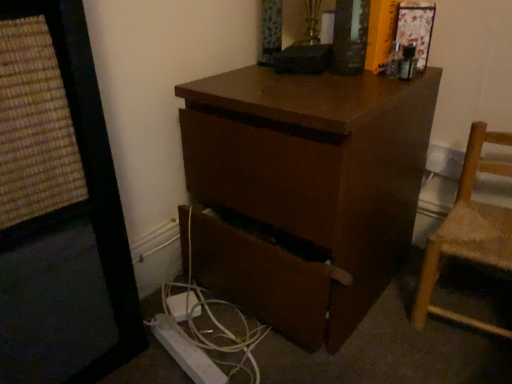
In order to face brown matte desk at center, should I rotate leftwards or rightwards?

Turn right by 6.671 degrees to look at brown matte desk at center.

Where is `brown matte desk at center`? brown matte desk at center is located at coordinates (305, 189).

Image resolution: width=512 pixels, height=384 pixels. I want to click on light brown woven wood chair at right, so click(469, 231).

Locate an element on the screen. This screenshot has width=512, height=384. white plastic cable at lower center is located at coordinates (210, 319).

Are brown matte desk at center and light brown woven wood chair at right far apart?

No, brown matte desk at center is not far away from light brown woven wood chair at right.

Which object is thinner, brown matte desk at center or light brown woven wood chair at right?

Thinner between the two is light brown woven wood chair at right.

From a real-world perspective, is brown matte desk at center above or below light brown woven wood chair at right?

Clearly, from a real-world perspective, brown matte desk at center is above light brown woven wood chair at right.

Is brown matte desk at center taller than light brown woven wood chair at right?

Indeed, brown matte desk at center has a greater height compared to light brown woven wood chair at right.

Locate an element on the screen. Image resolution: width=512 pixels, height=384 pixels. chair that is in front of the white plastic cable at lower center is located at coordinates (469, 231).

Is light brown woven wood chair at right not near white plastic cable at lower center?

No, light brown woven wood chair at right is not far away from white plastic cable at lower center.

Does light brown woven wood chair at right have a larger size compared to white plastic cable at lower center?

Yes, light brown woven wood chair at right is bigger than white plastic cable at lower center.

From the image's perspective, which one is positioned lower, white plastic cable at lower center or light brown woven wood chair at right?

white plastic cable at lower center appears lower in the image.

Does white plastic cable at lower center contain light brown woven wood chair at right?

No.

Locate an element on the screen. This screenshot has height=384, width=512. chair above the white plastic cable at lower center (from a real-world perspective) is located at coordinates (469, 231).

From the image's perspective, who appears lower, white plastic cable at lower center or brown matte desk at center?

white plastic cable at lower center is shown below in the image.

Which of these two, white plastic cable at lower center or brown matte desk at center, is bigger?

With larger size is brown matte desk at center.

Is white plastic cable at lower center oriented away from brown matte desk at center?

That's not correct — white plastic cable at lower center is not looking away from brown matte desk at center.

Which point is more distant from viewer, (x=476, y=211) or (x=336, y=251)?

The point (x=476, y=211) is more distant.

Can we say light brown woven wood chair at right lies outside brown matte desk at center?

Indeed, light brown woven wood chair at right is completely outside brown matte desk at center.

Locate an element on the screen. Image resolution: width=512 pixels, height=384 pixels. desk above the light brown woven wood chair at right (from a real-world perspective) is located at coordinates (305, 189).

Can you confirm if light brown woven wood chair at right is bigger than brown matte desk at center?

Actually, light brown woven wood chair at right might be smaller than brown matte desk at center.

Is brown matte desk at center positioned behind white plastic cable at lower center?

No, it is not.

From their relative heights in the image, would you say brown matte desk at center is taller or shorter than white plastic cable at lower center?

Considering their sizes, brown matte desk at center has more height than white plastic cable at lower center.

Between point (309, 148) and point (186, 299), which one is positioned in front?

Positioned in front is point (309, 148).

Identify the location of desk above the light brown woven wood chair at right (from a real-world perspective). (305, 189).

Locate an element on the screen. cable that appears behind the light brown woven wood chair at right is located at coordinates (x=210, y=319).

Which object lies nearer to the anchor point brown matte desk at center, light brown woven wood chair at right or white plastic cable at lower center?

white plastic cable at lower center is closer to brown matte desk at center.

Looking at the image, which one is located further to light brown woven wood chair at right, white plastic cable at lower center or brown matte desk at center?

white plastic cable at lower center is further to light brown woven wood chair at right.

Estimate the real-world distances between objects in this image. Which object is closer to light brown woven wood chair at right, brown matte desk at center or white plastic cable at lower center?

brown matte desk at center.

Considering their positions, is light brown woven wood chair at right positioned further to white plastic cable at lower center than brown matte desk at center?

Based on the image, light brown woven wood chair at right appears to be further to white plastic cable at lower center.

Based on their spatial positions, is brown matte desk at center or light brown woven wood chair at right closer to white plastic cable at lower center?

brown matte desk at center.

When comparing their distances from brown matte desk at center, does white plastic cable at lower center or light brown woven wood chair at right seem further?

light brown woven wood chair at right is positioned further to the anchor brown matte desk at center.

Where is `desk located between white plastic cable at lower center and light brown woven wood chair at right in the left-right direction`? This screenshot has width=512, height=384. desk located between white plastic cable at lower center and light brown woven wood chair at right in the left-right direction is located at coordinates (305, 189).